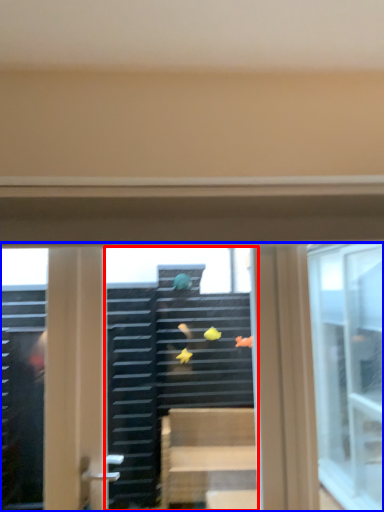
Question: Which point is further to the camera, shop window (highlighted by a red box) or window (highlighted by a blue box)?

Choices:
 (A) shop window
 (B) window

Answer: (A)